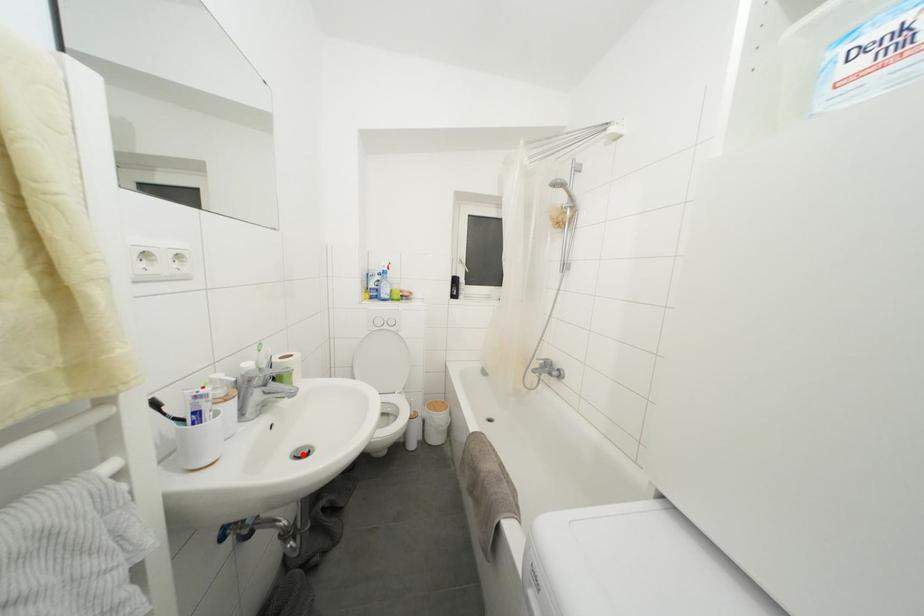
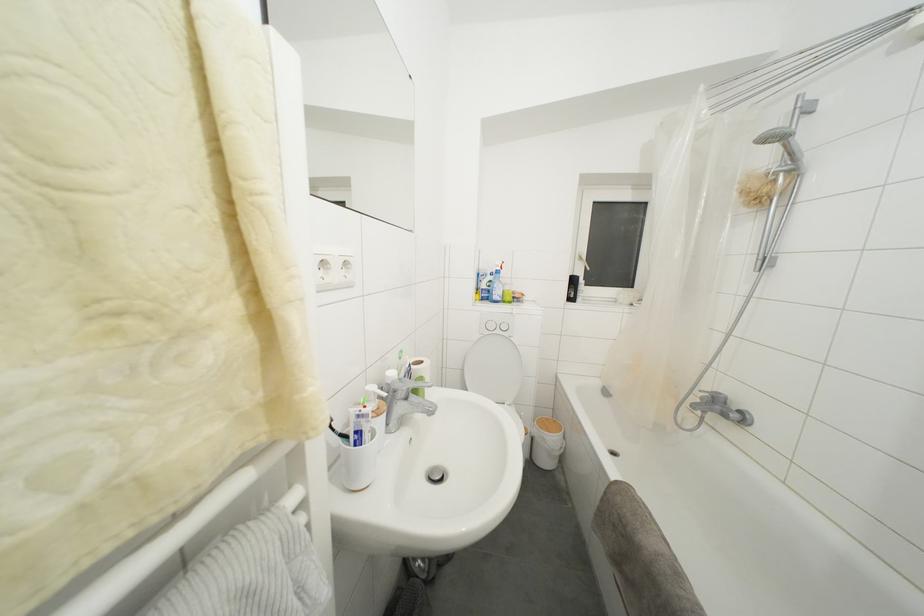
Question: I am providing you with two images of the same scene from different viewpoints. In image1, a red point is highlighted. Considering the same 3D point in image2, which of the following is correct?

Choices:
 (A) It is closer
 (B) It is farther

Answer: (A)